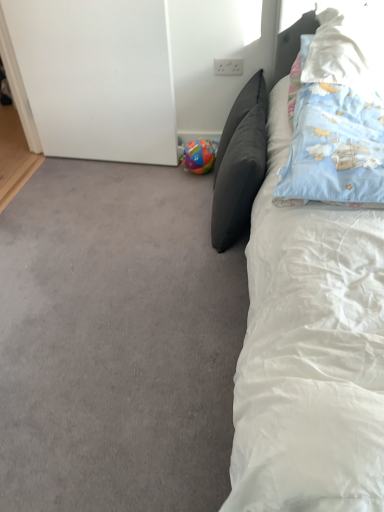
Question: Considering the positions of point (253, 196) and point (269, 169), is point (253, 196) closer or farther from the camera than point (269, 169)?

Choices:
 (A) farther
 (B) closer

Answer: (A)

Question: Is dark gray cushion at center, which is counted as the first pillow, starting from the left, taller or shorter than white soft bed at right?

Choices:
 (A) short
 (B) tall

Answer: (A)

Question: Which is farther from the white soft bed at right?

Choices:
 (A) gray carpet at lower left
 (B) white soft pillow at upper right, positioned as the 3th pillow in left-to-right order
 (C) dark gray cushion at center, positioned as the third pillow in right-to-left order
 (D) multicolored plastic ball at lower left
 (E) blue cotton pillow at upper right, acting as the second pillow starting from the left

Answer: (D)

Question: Which is farther from the dark gray cushion at center, positioned as the third pillow in right-to-left order?

Choices:
 (A) white soft pillow at upper right, the 1th pillow when ordered from right to left
 (B) blue cotton pillow at upper right, acting as the second pillow starting from the left
 (C) gray carpet at lower left
 (D) multicolored plastic ball at lower left
 (E) white soft bed at right

Answer: (E)